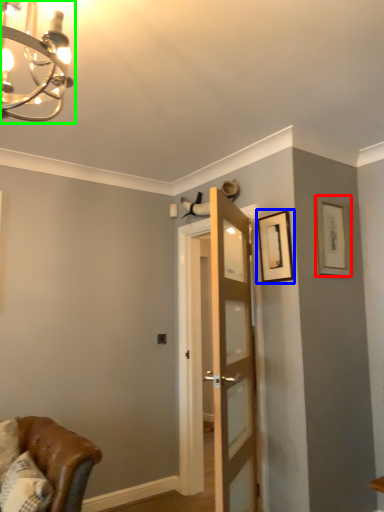
Question: Considering the real-world distances, which object is closest to picture frame (highlighted by a red box)? picture frame (highlighted by a blue box) or light fixture (highlighted by a green box).

Choices:
 (A) picture frame
 (B) light fixture

Answer: (A)